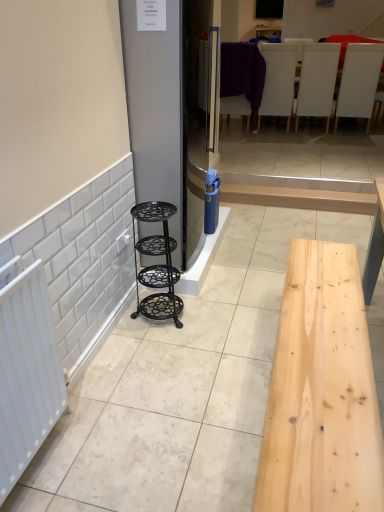
Locate an element on the screen. The image size is (384, 512). unoccupied region to the right of black wrought iron shelf at center left, the 5th furniture viewed from the right is located at coordinates (220, 311).